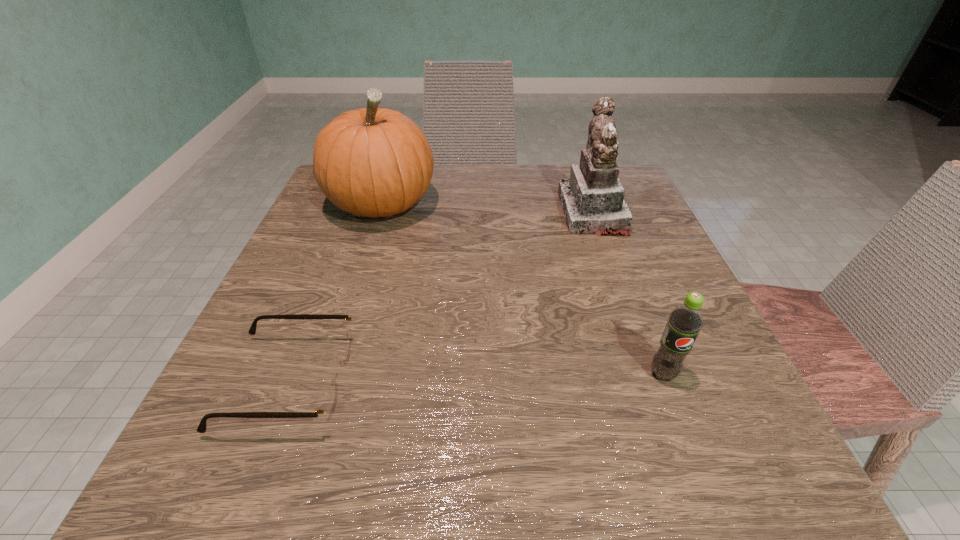
The image size is (960, 540). I want to click on empty space between the figurine and the shortest object, so click(442, 298).

The height and width of the screenshot is (540, 960). I want to click on free space between the figurine and the spectacles, so click(x=442, y=298).

At what (x,y) coordinates should I click in order to perform the action: click on free spot between the soda and the shortest object. Please return your answer as a coordinate pair (x, y). The height and width of the screenshot is (540, 960). Looking at the image, I should click on (476, 378).

Identify the location of free space between the spectacles and the third tallest object. (476, 378).

Identify which object is located as the third nearest to the shortest object. Please provide its 2D coordinates. Your answer should be formatted as a tuple, i.e. [(x, y)], where the tuple contains the x and y coordinates of a point satisfying the conditions above.

[(592, 200)]

You are a GUI agent. You are given a task and a screenshot of the screen. Output one action in this format:
    pyautogui.click(x=<x>, y=<y>)
    Task: Click on the object that stands as the third closest to the shortest object
    The height and width of the screenshot is (540, 960).
    Given the screenshot: What is the action you would take?
    [x=592, y=200]

This screenshot has height=540, width=960. Find the location of `free spot that satisfies the following two spatial constraints: 1. on the front label of the soda; 2. at the hinge ends of the spectacles`. free spot that satisfies the following two spatial constraints: 1. on the front label of the soda; 2. at the hinge ends of the spectacles is located at coordinates (666, 382).